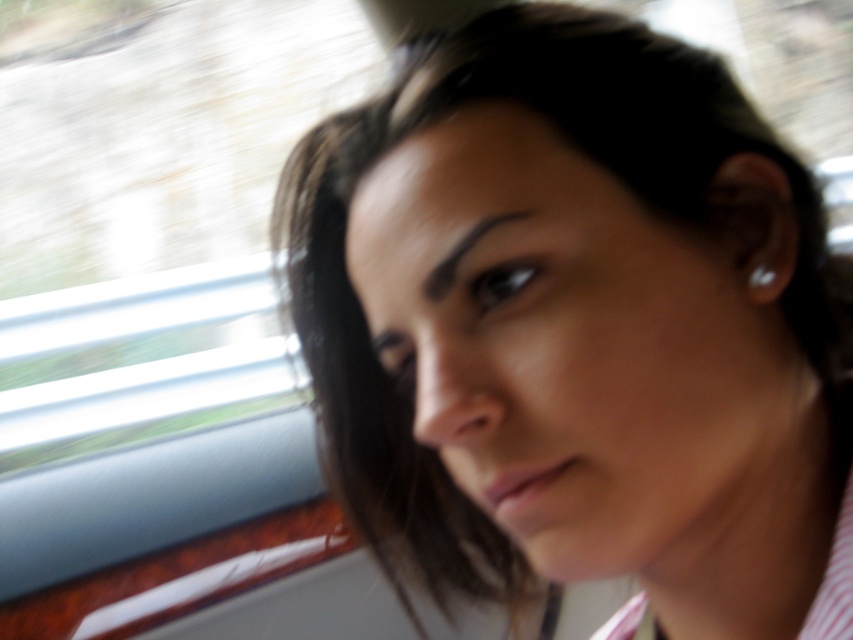
Describe the element at coordinates (463, 253) in the screenshot. I see `dark brown hair at upper center` at that location.

Can you confirm if dark brown hair at upper center is smaller than white pearl earring at ear?

No.

I want to click on dark brown hair at upper center, so click(463, 253).

Is smooth skin face at center taller than dark brown hair at upper center?

Correct, smooth skin face at center is much taller as dark brown hair at upper center.

Does point (614, 468) come closer to viewer compared to point (442, 269)?

Yes, point (614, 468) is closer to viewer.

The width and height of the screenshot is (853, 640). Identify the location of smooth skin face at center. (578, 348).

Which is above, smooth skin face at center or black matte eyeliner at center?

Positioned higher is black matte eyeliner at center.

Is smooth skin face at center to the left of black matte eyeliner at center from the viewer's perspective?

Incorrect, smooth skin face at center is not on the left side of black matte eyeliner at center.

Who is more forward, (757, 292) or (483, 282)?

Point (483, 282)

The height and width of the screenshot is (640, 853). I want to click on smooth skin face at center, so click(x=578, y=348).